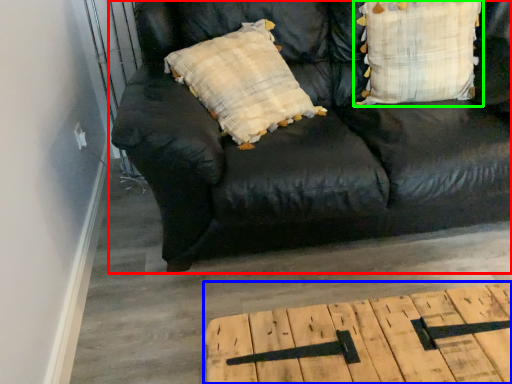
Question: Considering the real-world distances, which object is farthest from studio couch (highlighted by a red box)? table (highlighted by a blue box) or pillow (highlighted by a green box)?

Choices:
 (A) table
 (B) pillow

Answer: (A)